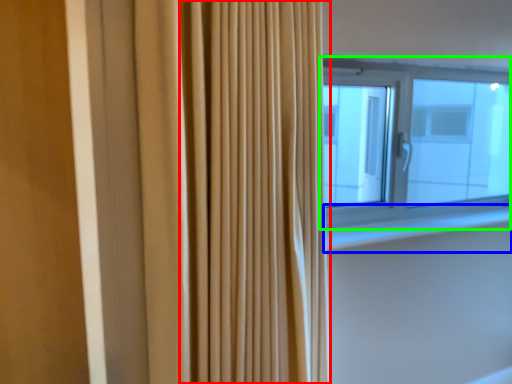
Question: Which is nearer to the shower curtain (highlighted by a red box)? window sill (highlighted by a blue box) or window (highlighted by a green box).

Choices:
 (A) window sill
 (B) window

Answer: (A)